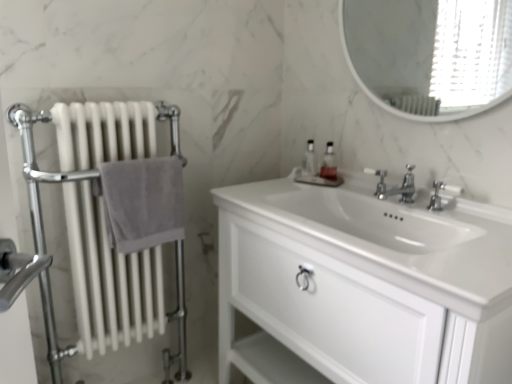
Question: Considering the relative sizes of white glossy cabinet at center and polished chrome faucet at center, acting as the second tap starting from the left, in the image provided, is white glossy cabinet at center shorter than polished chrome faucet at center, acting as the second tap starting from the left,?

Choices:
 (A) yes
 (B) no

Answer: (B)

Question: Is white glossy cabinet at center positioned before polished chrome faucet at center, acting as the second tap starting from the left?

Choices:
 (A) no
 (B) yes

Answer: (B)

Question: Can you confirm if white glossy cabinet at center is thinner than polished chrome faucet at center, the 1th tap viewed from the right?

Choices:
 (A) yes
 (B) no

Answer: (B)

Question: From the image's perspective, is white glossy cabinet at center beneath polished chrome faucet at center, the 1th tap viewed from the right?

Choices:
 (A) no
 (B) yes

Answer: (B)

Question: Can you confirm if white glossy cabinet at center is smaller than polished chrome faucet at center, the 1th tap viewed from the right?

Choices:
 (A) no
 (B) yes

Answer: (A)

Question: In terms of width, does chrome metallic faucet at center, arranged as the second tap when viewed from the right, look wider or thinner when compared to white glossy mirror at upper center?

Choices:
 (A) thin
 (B) wide

Answer: (B)

Question: Is chrome metallic faucet at center, which is counted as the first tap, starting from the left, to the left or to the right of white glossy mirror at upper center in the image?

Choices:
 (A) right
 (B) left

Answer: (B)

Question: From a real-world perspective, is chrome metallic faucet at center, arranged as the second tap when viewed from the right, physically located above or below white glossy mirror at upper center?

Choices:
 (A) below
 (B) above

Answer: (A)

Question: Considering the positions of chrome metallic faucet at center, which is counted as the first tap, starting from the left, and white glossy mirror at upper center in the image, is chrome metallic faucet at center, which is counted as the first tap, starting from the left, bigger or smaller than white glossy mirror at upper center?

Choices:
 (A) small
 (B) big

Answer: (A)

Question: From a real-world perspective, is translucent glass soap dispenser at center, placed as the 1th soap dispenser when sorted from left to right, above or below white metal radiator at left?

Choices:
 (A) above
 (B) below

Answer: (A)

Question: In terms of size, does translucent glass soap dispenser at center, placed as the 1th soap dispenser when sorted from left to right, appear bigger or smaller than white metal radiator at left?

Choices:
 (A) big
 (B) small

Answer: (B)

Question: Is translucent glass soap dispenser at center, placed as the 1th soap dispenser when sorted from left to right, situated inside white metal radiator at left or outside?

Choices:
 (A) inside
 (B) outside

Answer: (B)

Question: From the image's perspective, is translucent glass soap dispenser at center, which appears as the 2th soap dispenser when viewed from the right, above or below white metal radiator at left?

Choices:
 (A) above
 (B) below

Answer: (A)

Question: Is polished chrome faucet at center inside or outside of white metal radiator at left?

Choices:
 (A) outside
 (B) inside

Answer: (A)

Question: Is point (372, 172) positioned closer to the camera than point (143, 319)?

Choices:
 (A) closer
 (B) farther

Answer: (A)